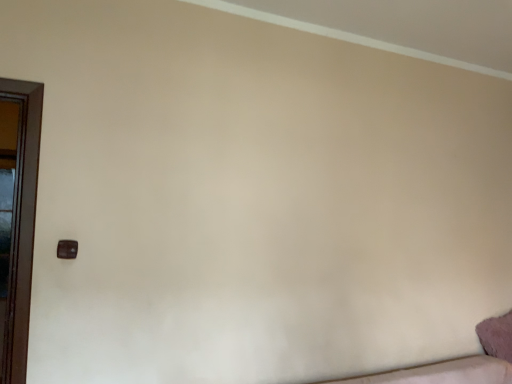
The height and width of the screenshot is (384, 512). What are the coordinates of `fuzzy pink pillow at lower right` in the screenshot? It's located at (496, 336).

What do you see at coordinates (496, 336) in the screenshot?
I see `fuzzy pink pillow at lower right` at bounding box center [496, 336].

Measure the distance between point (486,339) and camera.

The depth of point (486,339) is 8.65 feet.

In the scene shown: What is the approximate height of fuzzy pink pillow at lower right?

fuzzy pink pillow at lower right is 12.19 inches tall.

The height and width of the screenshot is (384, 512). What do you see at coordinates (67, 249) in the screenshot?
I see `matte brown door handle at lower left` at bounding box center [67, 249].

Find the location of a particular element. This screenshot has width=512, height=384. matte brown door handle at lower left is located at coordinates (67, 249).

This screenshot has height=384, width=512. Identify the location of fuzzy pink pillow at lower right. (496, 336).

Is fuzzy pink pillow at lower right to the right of matte brown door handle at lower left from the viewer's perspective?

Yes, fuzzy pink pillow at lower right is to the right of matte brown door handle at lower left.

Relative to matte brown door handle at lower left, is fuzzy pink pillow at lower right in front or behind?

Clearly, fuzzy pink pillow at lower right is behind matte brown door handle at lower left.

Between point (484, 343) and point (61, 248), which one is positioned in front?

Positioned in front is point (61, 248).

From the image's perspective, would you say fuzzy pink pillow at lower right is shown under matte brown door handle at lower left?

Yes.

From a real-world perspective, relative to matte brown door handle at lower left, is fuzzy pink pillow at lower right vertically above or below?

fuzzy pink pillow at lower right is below matte brown door handle at lower left.

Between fuzzy pink pillow at lower right and matte brown door handle at lower left, which one has larger width?

fuzzy pink pillow at lower right is wider.

Considering the relative sizes of fuzzy pink pillow at lower right and matte brown door handle at lower left in the image provided, is fuzzy pink pillow at lower right taller than matte brown door handle at lower left?

Yes.

Which of these two, fuzzy pink pillow at lower right or matte brown door handle at lower left, is bigger?

fuzzy pink pillow at lower right is bigger.

Does fuzzy pink pillow at lower right contain matte brown door handle at lower left?

Definitely not — matte brown door handle at lower left is not inside fuzzy pink pillow at lower right.

Is fuzzy pink pillow at lower right beside matte brown door handle at lower left?

No, fuzzy pink pillow at lower right is not with matte brown door handle at lower left.

Is fuzzy pink pillow at lower right aimed at matte brown door handle at lower left?

Yes.

Measure the distance between fuzzy pink pillow at lower right and matte brown door handle at lower left.

fuzzy pink pillow at lower right and matte brown door handle at lower left are 2.46 meters apart from each other.

Image resolution: width=512 pixels, height=384 pixels. What are the coordinates of `pillow below the matte brown door handle at lower left (from a real-world perspective)` in the screenshot? It's located at [x=496, y=336].

From the picture: Is matte brown door handle at lower left to the left or to the right of fuzzy pink pillow at lower right in the image?

matte brown door handle at lower left is to the left of fuzzy pink pillow at lower right.

Is the depth of matte brown door handle at lower left less than that of fuzzy pink pillow at lower right?

Yes, matte brown door handle at lower left is closer to the viewer.

Is point (63, 251) in front of point (499, 329)?

Yes.

From the image's perspective, is matte brown door handle at lower left under fuzzy pink pillow at lower right?

Actually, matte brown door handle at lower left appears above fuzzy pink pillow at lower right in the image.

Consider the image. From a real-world perspective, is matte brown door handle at lower left below fuzzy pink pillow at lower right?

No, from a real-world perspective, matte brown door handle at lower left is not below fuzzy pink pillow at lower right.

Considering the sizes of objects matte brown door handle at lower left and fuzzy pink pillow at lower right in the image provided, who is wider, matte brown door handle at lower left or fuzzy pink pillow at lower right?

fuzzy pink pillow at lower right.

Considering the sizes of objects matte brown door handle at lower left and fuzzy pink pillow at lower right in the image provided, who is taller, matte brown door handle at lower left or fuzzy pink pillow at lower right?

With more height is fuzzy pink pillow at lower right.

Does matte brown door handle at lower left have a smaller size compared to fuzzy pink pillow at lower right?

Yes.

Can fuzzy pink pillow at lower right be found inside matte brown door handle at lower left?

No.

Are matte brown door handle at lower left and fuzzy pink pillow at lower right far apart?

Indeed, matte brown door handle at lower left is not near fuzzy pink pillow at lower right.

Is fuzzy pink pillow at lower right at the back of matte brown door handle at lower left?

No.

The width and height of the screenshot is (512, 384). What are the coordinates of `pillow behind the matte brown door handle at lower left` in the screenshot? It's located at (496, 336).

In order to click on pillow below the matte brown door handle at lower left (from a real-world perspective) in this screenshot , I will do `click(496, 336)`.

You are a GUI agent. You are given a task and a screenshot of the screen. Output one action in this format:
    pyautogui.click(x=<x>, y=<y>)
    Task: Click on the door handle above the fuzzy pink pillow at lower right (from a real-world perspective)
    
    Given the screenshot: What is the action you would take?
    pyautogui.click(x=67, y=249)